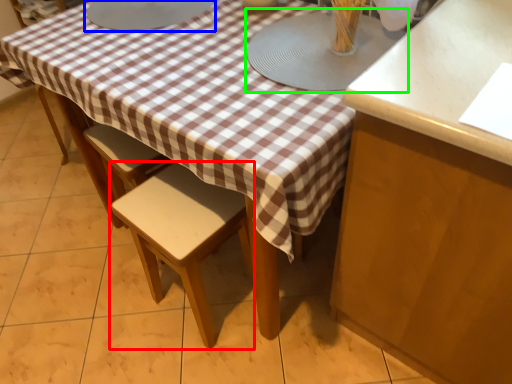
Question: Estimate the real-world distances between objects in this image. Which object is farther from stool (highlighted by a red box), round table (highlighted by a blue box) or round table (highlighted by a green box)?

Choices:
 (A) round table
 (B) round table

Answer: (A)